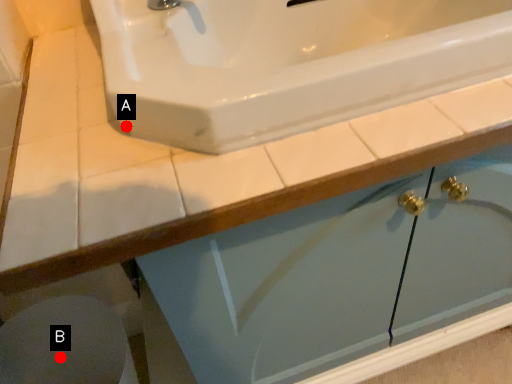
Question: Two points are circled on the image, labeled by A and B beside each circle. Which point is closer to the camera?

Choices:
 (A) A is closer
 (B) B is closer

Answer: (A)